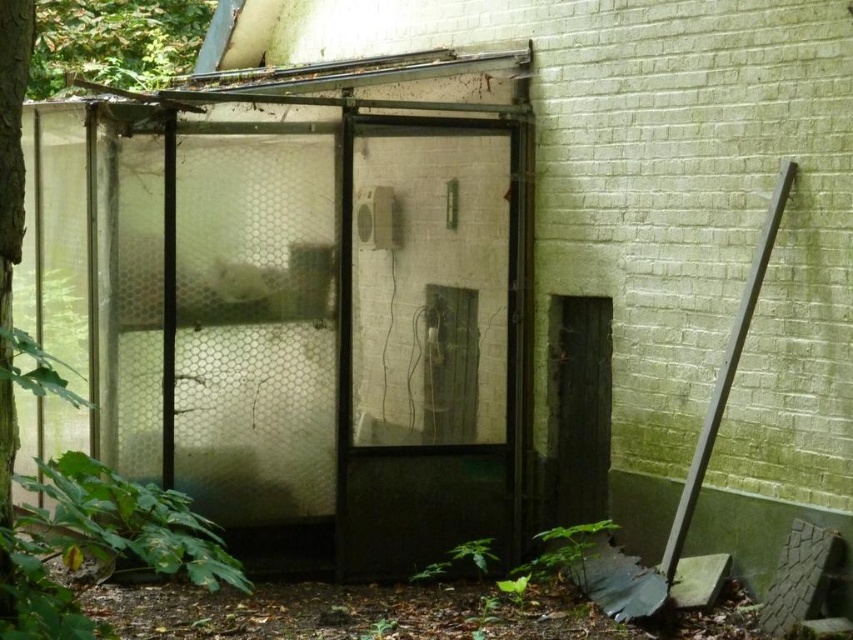
Question: Which object is farther from the camera taking this photo?

Choices:
 (A) dark gray metal shovel at right
 (B) transparent plastic cage at center

Answer: (B)

Question: Can you confirm if transparent plastic screen door at center is thinner than dark gray metal shovel at right?

Choices:
 (A) yes
 (B) no

Answer: (B)

Question: Can you confirm if transparent plastic cage at center is thinner than transparent plastic screen door at center?

Choices:
 (A) yes
 (B) no

Answer: (B)

Question: Based on their relative distances, which object is nearer to the dark gray metal shovel at right?

Choices:
 (A) transparent plastic cage at center
 (B) transparent plastic screen door at center

Answer: (B)

Question: Which point appears farthest from the camera in this image?

Choices:
 (A) (489, 173)
 (B) (741, 317)
 (C) (419, 545)

Answer: (A)

Question: Can you confirm if transparent plastic cage at center is wider than dark gray metal shovel at right?

Choices:
 (A) yes
 (B) no

Answer: (A)